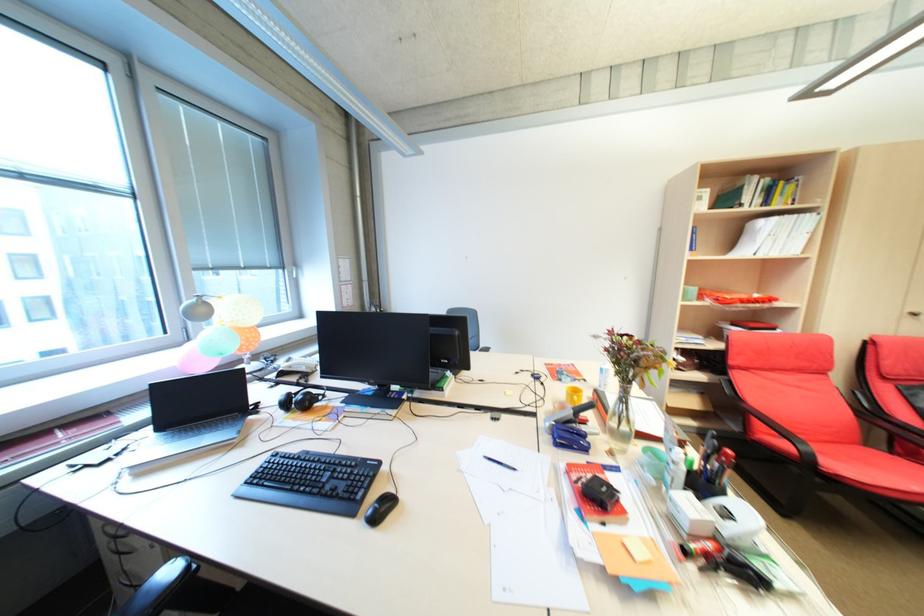
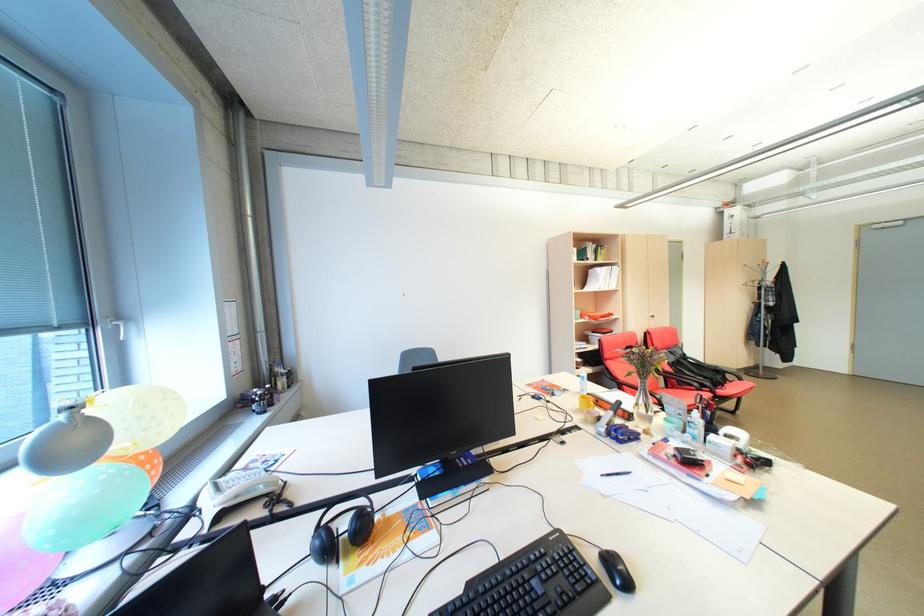
In the second image, find the point that corresponds to the point at 580,411 in the first image.

(621, 413)